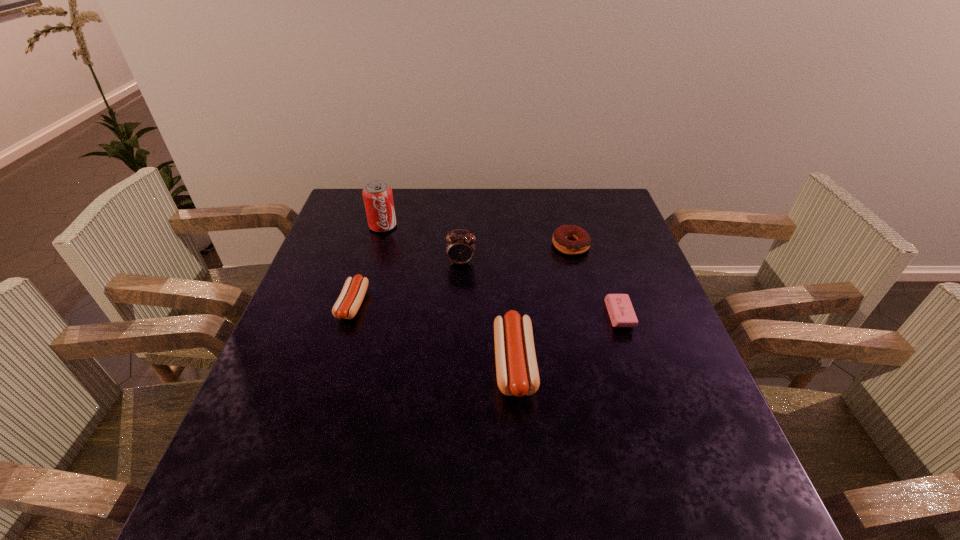
You are a GUI agent. You are given a task and a screenshot of the screen. Output one action in this format:
    pyautogui.click(x=<x>, y=<y>)
    Task: Click on the free space in the image that satisfies the following two spatial constraints: 1. on the front side of the tallest object; 2. on the right side of the right sausage
    
    Given the screenshot: What is the action you would take?
    pyautogui.click(x=343, y=364)

Where is `vacant space that satisfies the following two spatial constraints: 1. on the face of the eraser; 2. on the right side of the second tallest object`? This screenshot has width=960, height=540. vacant space that satisfies the following two spatial constraints: 1. on the face of the eraser; 2. on the right side of the second tallest object is located at coordinates (459, 315).

Identify the location of free space that satisfies the following two spatial constraints: 1. on the face of the right sausage; 2. on the right side of the fourth nearest object. (456, 364).

The height and width of the screenshot is (540, 960). I want to click on free location that satisfies the following two spatial constraints: 1. on the front side of the shortest object; 2. on the left side of the shorter sausage, so click(349, 315).